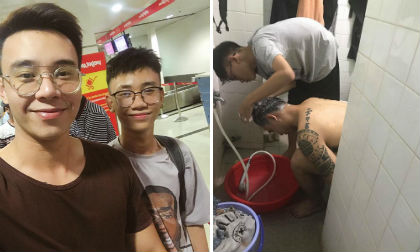
This screenshot has height=252, width=420. What are the coordinates of `purple bucket` in the screenshot? It's located at (253, 245).